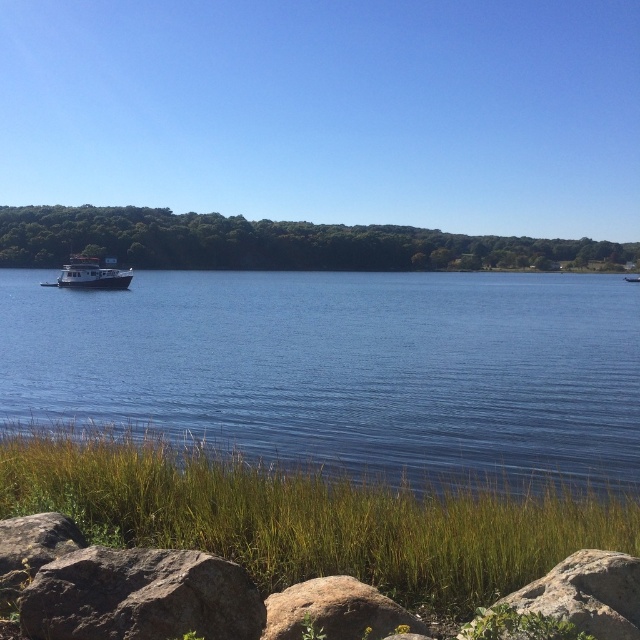
Does point (211, 588) come behind point (294, 586)?

No, (211, 588) is in front of (294, 586).

Which is more to the right, brown rough rock at lower left or brown rough rock at lower center?

brown rough rock at lower center is more to the right.

Which is behind, point (74, 616) or point (268, 612)?

The point (268, 612) is more distant.

Locate an element on the screen. This screenshot has height=640, width=640. brown rough rock at lower left is located at coordinates [140, 596].

Between smooth gray rock at lower left and white glossy houseboat at left, which one appears on the left side from the viewer's perspective?

white glossy houseboat at left is more to the left.

Is smooth gray rock at lower left to the left of white glossy houseboat at left from the viewer's perspective?

In fact, smooth gray rock at lower left is to the right of white glossy houseboat at left.

You are a GUI agent. You are given a task and a screenshot of the screen. Output one action in this format:
    pyautogui.click(x=<x>, y=<y>)
    Task: Click on the smooth gray rock at lower left
    The width and height of the screenshot is (640, 640).
    Given the screenshot: What is the action you would take?
    pyautogui.click(x=29, y=552)

Does brown rough rock at lower center have a greater width compared to smooth gray rock at lower left?

Correct, the width of brown rough rock at lower center exceeds that of smooth gray rock at lower left.

Is brown rough rock at lower center smaller than smooth gray rock at lower left?

Actually, brown rough rock at lower center might be larger than smooth gray rock at lower left.

The height and width of the screenshot is (640, 640). I want to click on brown rough rock at lower center, so click(x=336, y=611).